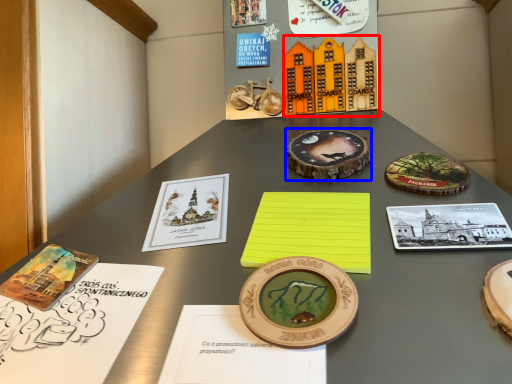
Question: Which point is further to the camera, toy (highlighted by a red box) or coin (highlighted by a blue box)?

Choices:
 (A) toy
 (B) coin

Answer: (A)